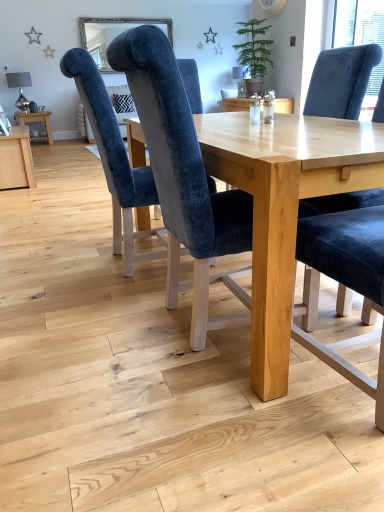
Question: Considering the relative sizes of velvet blue chair at center, which is counted as the 1th chair, starting from the right, and light wood table at center, which is the 1th table in bottom-to-top order, in the image provided, is velvet blue chair at center, which is counted as the 1th chair, starting from the right, smaller than light wood table at center, which is the 1th table in bottom-to-top order,?

Choices:
 (A) no
 (B) yes

Answer: (B)

Question: Is velvet blue chair at center, which is counted as the 1th chair, starting from the right, facing towards light wood table at center, arranged as the second table when viewed from the left?

Choices:
 (A) no
 (B) yes

Answer: (B)

Question: Can you confirm if velvet blue chair at center, which is counted as the 1th chair, starting from the right, is thinner than light wood table at center, which ranks as the 1th table in front-to-back order?

Choices:
 (A) no
 (B) yes

Answer: (B)

Question: Does velvet blue chair at center, the 3th chair when ordered from left to right, appear on the left side of light wood table at center, positioned as the 2th table in top-to-bottom order?

Choices:
 (A) no
 (B) yes

Answer: (A)

Question: Are velvet blue chair at center, which is counted as the 1th chair, starting from the right, and light wood table at center, which ranks as the 1th table in front-to-back order, making contact?

Choices:
 (A) no
 (B) yes

Answer: (A)

Question: Is velvet blue chair at center, the 3th chair when ordered from left to right, far away from light wood table at center, which ranks as the 1th table in right-to-left order?

Choices:
 (A) yes
 (B) no

Answer: (B)

Question: Does velvet blue chair at center, which is counted as the 1th chair, starting from the right, turn towards velvet blue chair at center, arranged as the second chair when viewed from the left?

Choices:
 (A) yes
 (B) no

Answer: (A)

Question: Can you confirm if velvet blue chair at center, the 3th chair when ordered from left to right, is wider than velvet blue chair at center, positioned as the 2th chair in right-to-left order?

Choices:
 (A) no
 (B) yes

Answer: (A)

Question: Does velvet blue chair at center, the 3th chair when ordered from left to right, lie behind velvet blue chair at center, arranged as the second chair when viewed from the left?

Choices:
 (A) yes
 (B) no

Answer: (B)

Question: Are velvet blue chair at center, which is counted as the 1th chair, starting from the right, and velvet blue chair at center, arranged as the second chair when viewed from the left, making contact?

Choices:
 (A) no
 (B) yes

Answer: (A)

Question: Can you confirm if velvet blue chair at center, which is counted as the 1th chair, starting from the right, is thinner than velvet blue chair at center, arranged as the second chair when viewed from the left?

Choices:
 (A) yes
 (B) no

Answer: (A)

Question: Is velvet blue chair at center, the 3th chair when ordered from left to right, turned away from velvet blue chair at center, positioned as the 2th chair in right-to-left order?

Choices:
 (A) yes
 (B) no

Answer: (B)

Question: From a real-world perspective, is velvet blue chair at center, acting as the third chair starting from the right, over green matte potted plant at upper center?

Choices:
 (A) yes
 (B) no

Answer: (B)